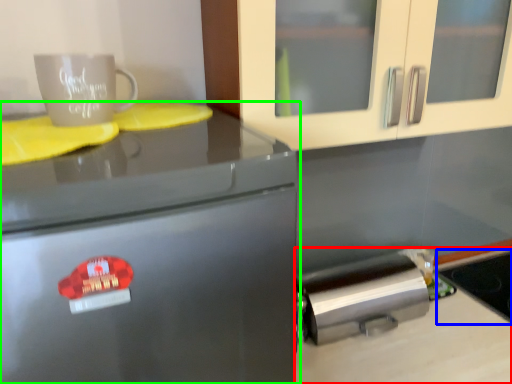
Question: Which is farther away from counter top (highlighted by a red box)? appliance (highlighted by a blue box) or home appliance (highlighted by a green box)?

Choices:
 (A) appliance
 (B) home appliance

Answer: (B)